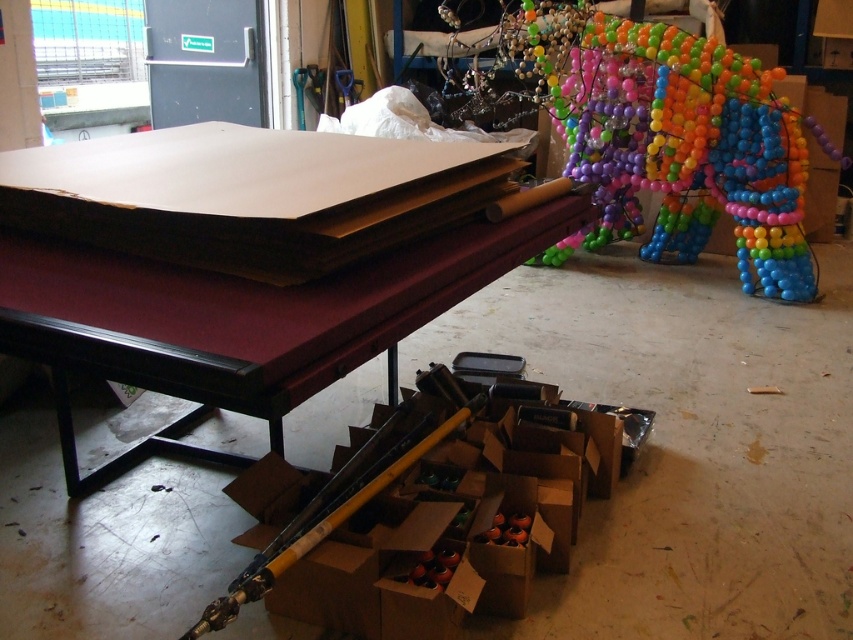
Question: Which point is farther to the camera?

Choices:
 (A) (764, 141)
 (B) (277, 424)

Answer: (A)

Question: Does maroon felt pool table at center appear under multicolored plastic balloon at upper right?

Choices:
 (A) no
 (B) yes

Answer: (B)

Question: Is maroon felt pool table at center thinner than multicolored plastic balloon at upper right?

Choices:
 (A) yes
 (B) no

Answer: (A)

Question: Considering the relative positions of maroon felt pool table at center and multicolored plastic balloon at upper right in the image provided, where is maroon felt pool table at center located with respect to multicolored plastic balloon at upper right?

Choices:
 (A) left
 (B) right

Answer: (A)

Question: Which point is closer to the camera taking this photo?

Choices:
 (A) (730, 61)
 (B) (215, 314)

Answer: (B)